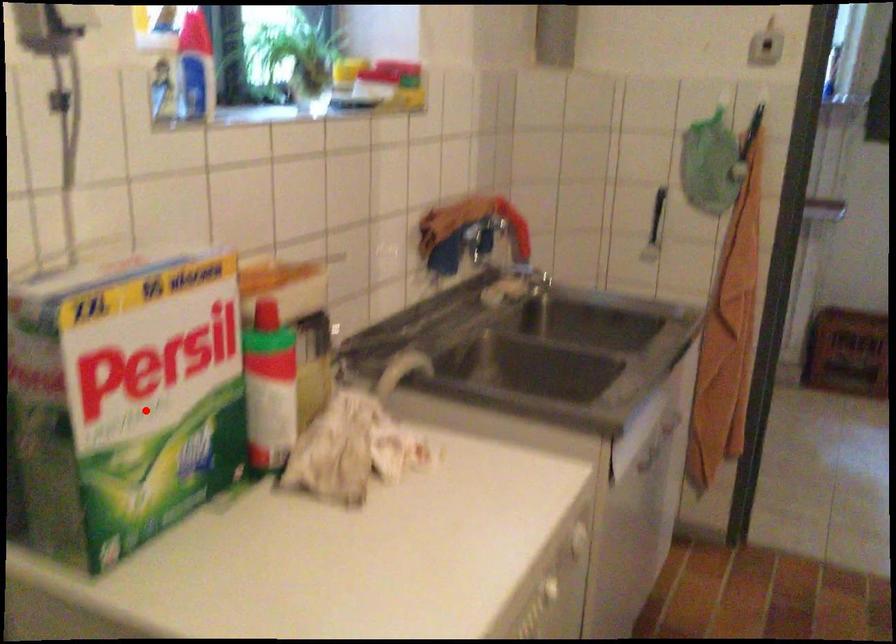
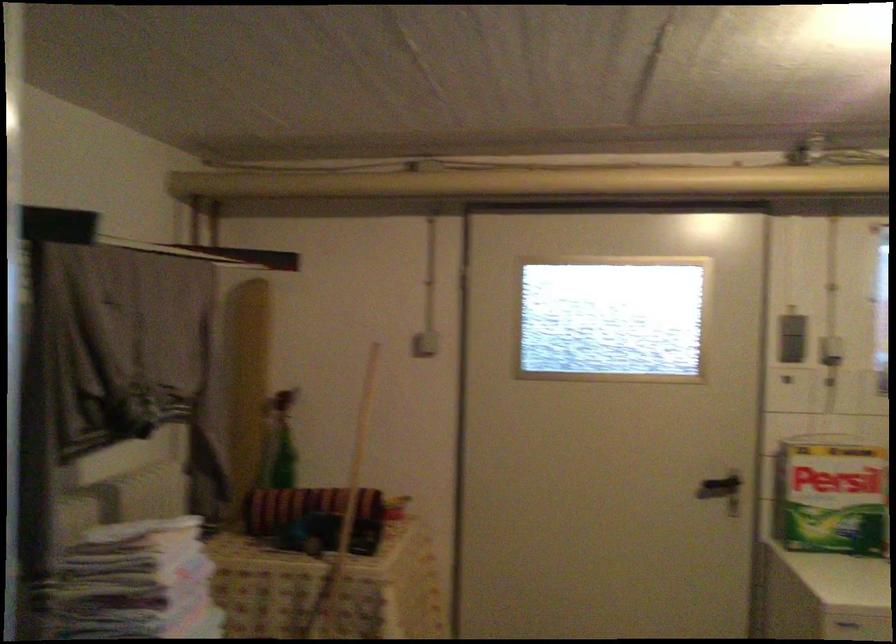
Question: I am providing you with two images of the same scene from different viewpoints. Image1 has a red point marked. In image2, the corresponding 3D location appears at what relative position? Reply with the corresponding letter.

Choices:
 (A) Closer
 (B) Farther

Answer: (B)